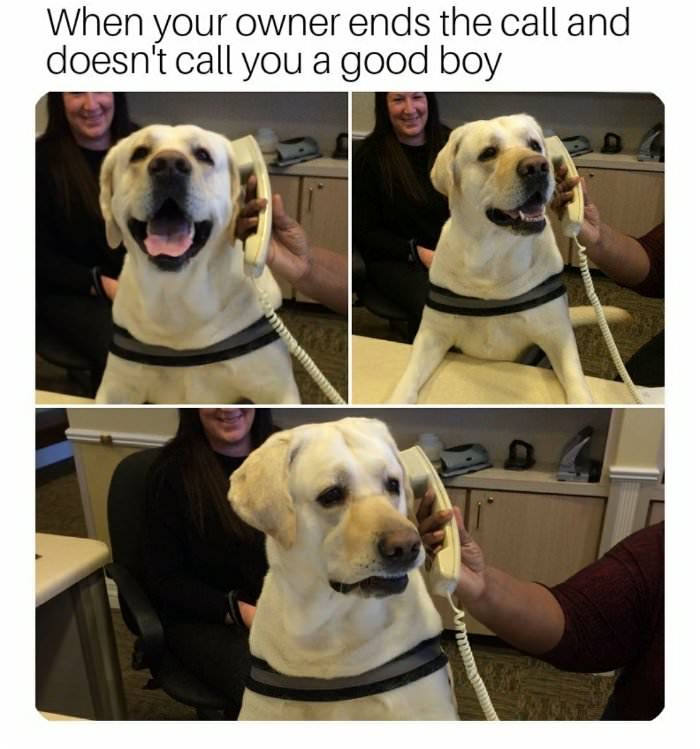
The width and height of the screenshot is (700, 749). Identify the location of phone. (421, 464).